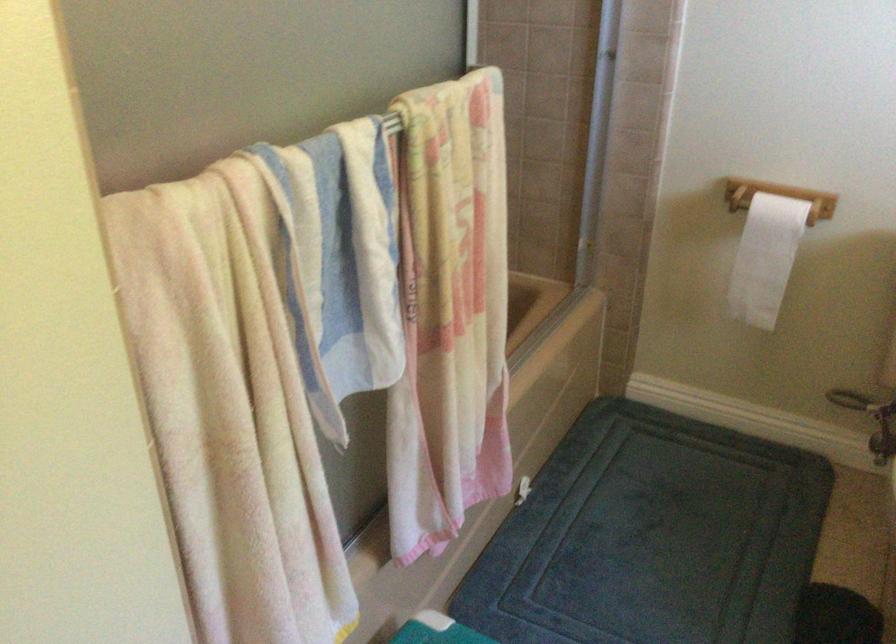
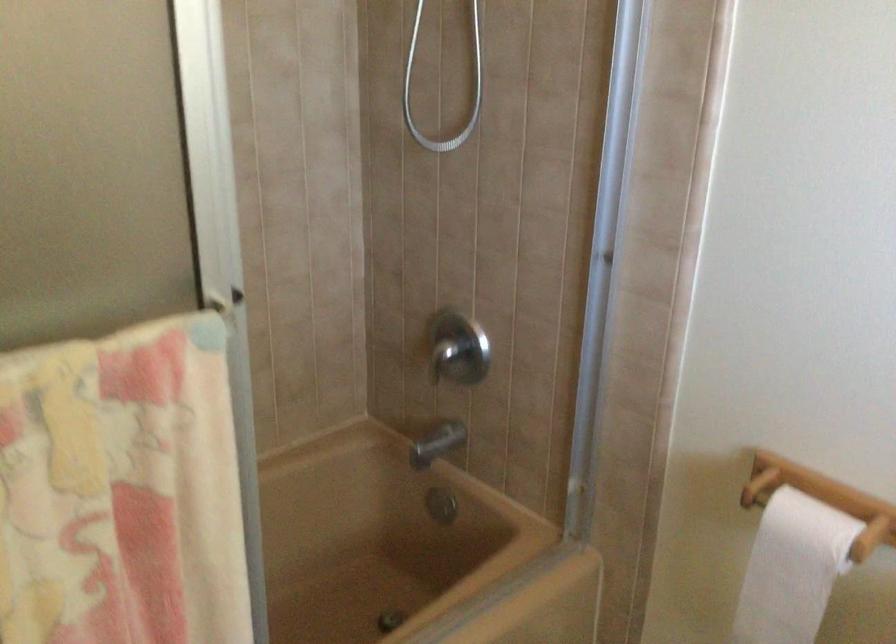
Which direction would the cameraman need to move to produce the second image?

The movement direction of the cameraman is right, forward.